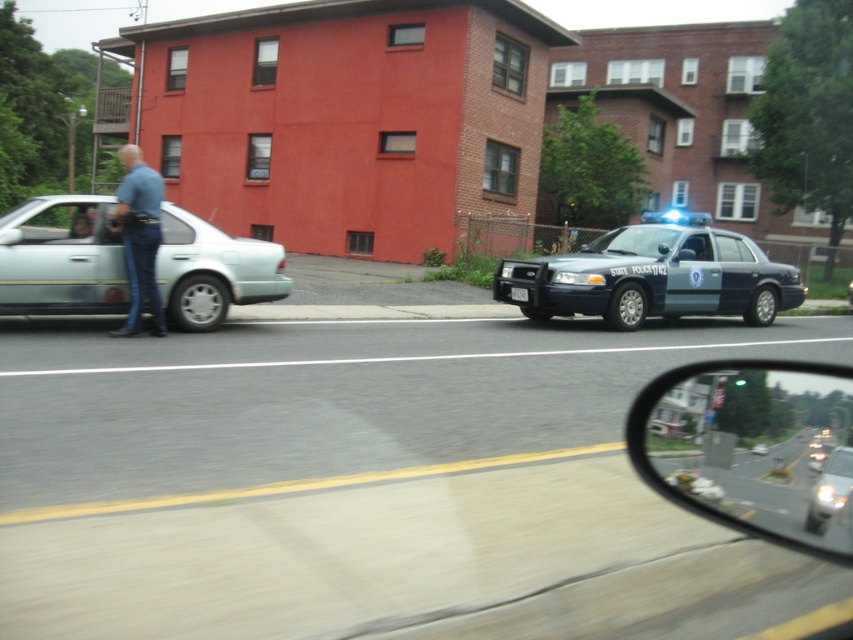
Between clear glass side mirror at lower right and metallic blue police car at right, which one is positioned higher?

Positioned higher is metallic blue police car at right.

In the scene shown: Which of these two, clear glass side mirror at lower right or metallic blue police car at right, stands taller?

With more height is metallic blue police car at right.

Is point (717, 468) positioned before point (589, 307)?

Yes.

The width and height of the screenshot is (853, 640). What are the coordinates of `clear glass side mirror at lower right` in the screenshot? It's located at (752, 449).

Is clear glass side mirror at lower right smaller than silver metallic sedan at left?

Yes, clear glass side mirror at lower right is smaller than silver metallic sedan at left.

Can you confirm if clear glass side mirror at lower right is shorter than silver metallic sedan at left?

Yes.

Which is behind, point (813, 371) or point (61, 260)?

Positioned behind is point (813, 371).

Identify the location of clear glass side mirror at lower right. The width and height of the screenshot is (853, 640). (752, 449).

Can you confirm if clear glass side mirror at lower right is taller than blue denim jeans at left?

No, clear glass side mirror at lower right is not taller than blue denim jeans at left.

Is clear glass side mirror at lower right below blue denim jeans at left?

Indeed, clear glass side mirror at lower right is positioned under blue denim jeans at left.

Between point (759, 502) and point (148, 221), which one is positioned behind?

The point (148, 221) is behind.

You are a GUI agent. You are given a task and a screenshot of the screen. Output one action in this format:
    pyautogui.click(x=<x>, y=<y>)
    Task: Click on the clear glass side mirror at lower right
    This screenshot has width=853, height=640.
    Given the screenshot: What is the action you would take?
    pyautogui.click(x=752, y=449)